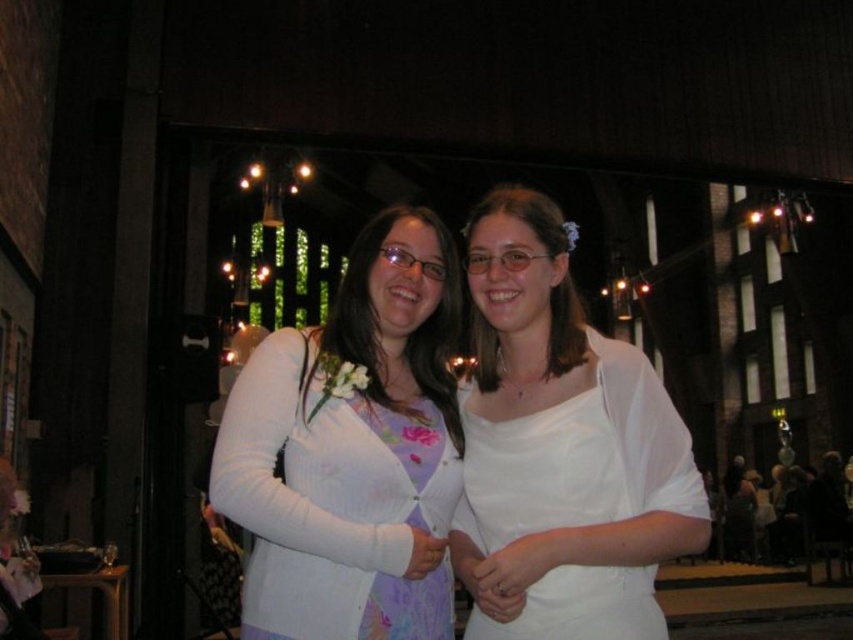
Question: Can you confirm if white matte cardigan at center is positioned above white satin dress at center?

Choices:
 (A) no
 (B) yes

Answer: (A)

Question: Can you confirm if white matte cardigan at center is positioned to the right of white satin dress at center?

Choices:
 (A) no
 (B) yes

Answer: (A)

Question: Which object appears closest to the camera in this image?

Choices:
 (A) white matte cardigan at center
 (B) white satin dress at center

Answer: (B)

Question: Which of the following is the closest to the observer?

Choices:
 (A) white satin dress at center
 (B) white matte cardigan at center

Answer: (A)

Question: Is white matte cardigan at center wider than white satin dress at center?

Choices:
 (A) no
 (B) yes

Answer: (B)